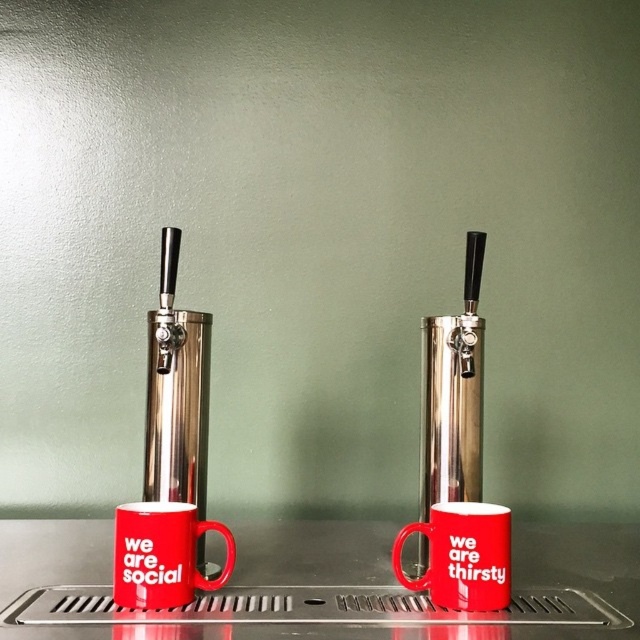
Is metallic stainless steel counter at center taller than matte ceramic mug at lower left?

Incorrect, metallic stainless steel counter at center's height is not larger of matte ceramic mug at lower left's.

Which is above, metallic stainless steel counter at center or matte ceramic mug at lower left?

matte ceramic mug at lower left

Where is `metallic stainless steel counter at center`? metallic stainless steel counter at center is located at coordinates (310, 572).

Can you confirm if metallic stainless steel counter at center is thinner than matte red mug at center?

In fact, metallic stainless steel counter at center might be wider than matte red mug at center.

Does metallic stainless steel counter at center lie in front of matte red mug at center?

Yes.

This screenshot has height=640, width=640. Describe the element at coordinates (310, 572) in the screenshot. I see `metallic stainless steel counter at center` at that location.

Find the location of a particular element. This screenshot has width=640, height=640. metallic stainless steel counter at center is located at coordinates (310, 572).

Does matte ceramic mug at lower left have a smaller size compared to matte red mug at center?

Incorrect, matte ceramic mug at lower left is not smaller in size than matte red mug at center.

Which is behind, point (134, 524) or point (472, 545)?

Point (472, 545)

Where is `matte ceramic mug at lower left`? matte ceramic mug at lower left is located at coordinates (163, 554).